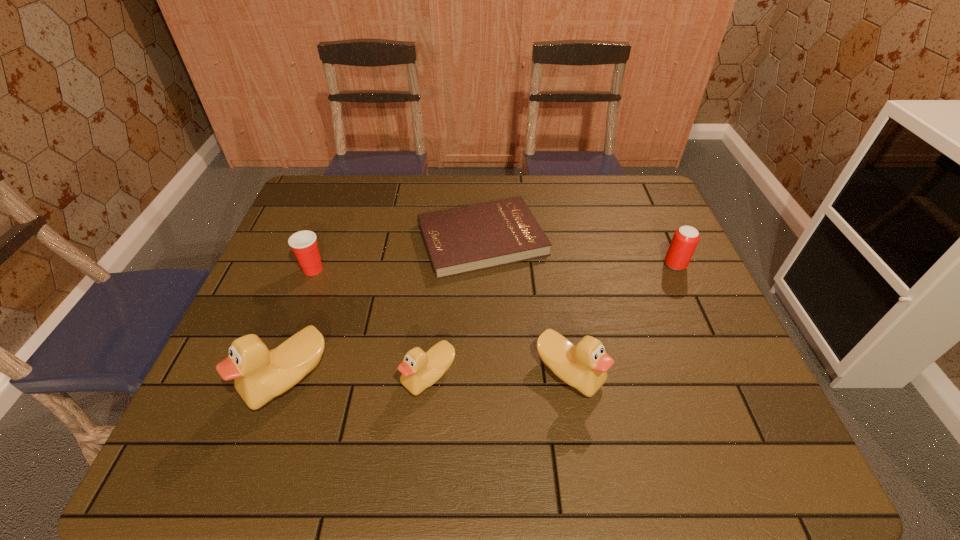
Find the location of a particular element. This screenshot has width=960, height=540. vacant space situated 0.150m at the beak of the shortest duck is located at coordinates (335, 376).

Find the location of a particular element. This screenshot has width=960, height=540. vacant space located at the beak of the shortest duck is located at coordinates (232, 376).

Find the location of `vacant space positioned 0.390m at the beak of the shortest duck`. vacant space positioned 0.390m at the beak of the shortest duck is located at coordinates (228, 376).

Where is `vacant point located 0.070m on the back of the hardback book`? The width and height of the screenshot is (960, 540). vacant point located 0.070m on the back of the hardback book is located at coordinates (482, 193).

I want to click on free location located on the right of the Dixie cup, so click(391, 269).

You are a GUI agent. You are given a task and a screenshot of the screen. Output one action in this format:
    pyautogui.click(x=<x>, y=<y>)
    Task: Click on the vacant space situated 0.090m on the left of the beer can
    This screenshot has width=960, height=540.
    Given the screenshot: What is the action you would take?
    pyautogui.click(x=632, y=265)

You are a GUI agent. You are given a task and a screenshot of the screen. Output one action in this format:
    pyautogui.click(x=<x>, y=<y>)
    Task: Click on the object positioned at the far edge
    This screenshot has height=540, width=960.
    Given the screenshot: What is the action you would take?
    pyautogui.click(x=460, y=240)

You are a GUI agent. You are given a task and a screenshot of the screen. Output one action in this format:
    pyautogui.click(x=<x>, y=<y>)
    Task: Click on the duck located at the left edge
    The image size is (960, 540).
    Given the screenshot: What is the action you would take?
    pyautogui.click(x=260, y=375)

Identify the location of Dixie cup that is positioned at the left edge. (303, 243).

The image size is (960, 540). Find the location of `object situated at the right edge`. object situated at the right edge is located at coordinates click(685, 239).